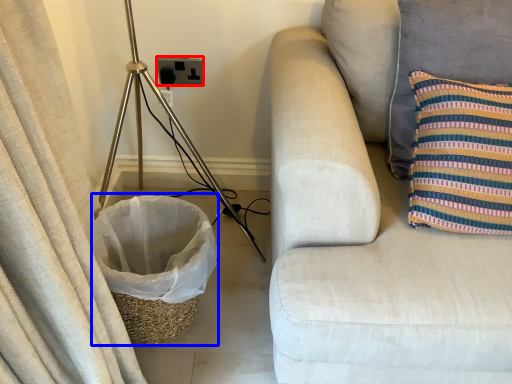
Question: Which point is further to the camera, electric outlet (highlighted by a red box) or laundry basket (highlighted by a blue box)?

Choices:
 (A) electric outlet
 (B) laundry basket

Answer: (A)